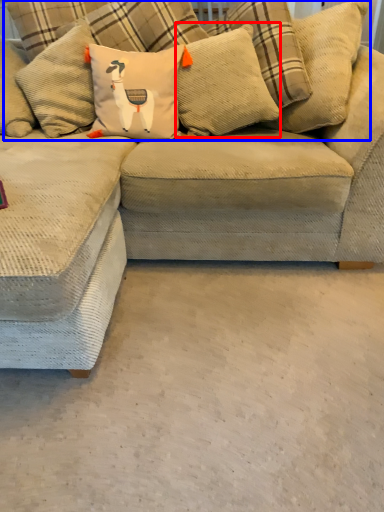
Question: Which object appears closest to the camera in this image, pillow (highlighted by a red box) or pillow (highlighted by a blue box)?

Choices:
 (A) pillow
 (B) pillow

Answer: (B)